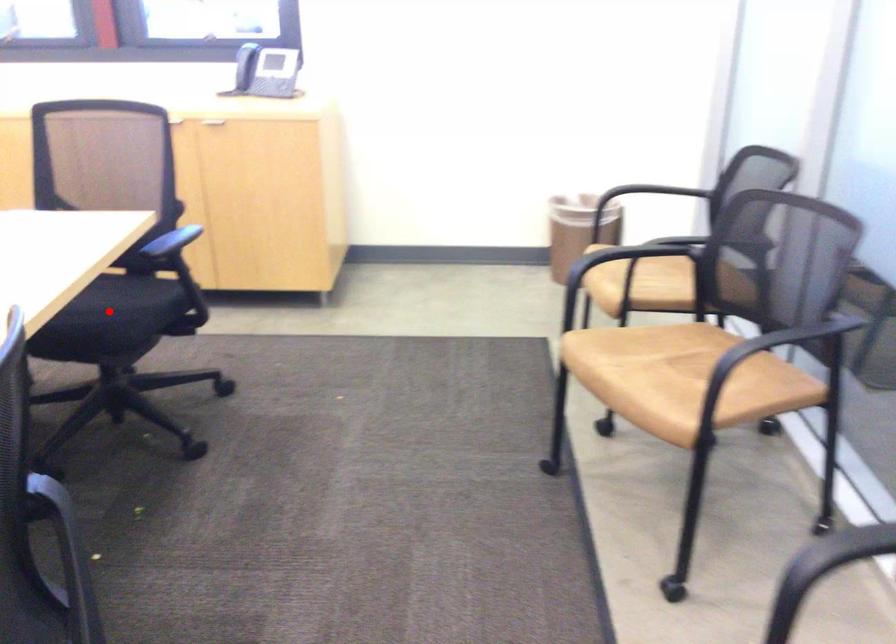
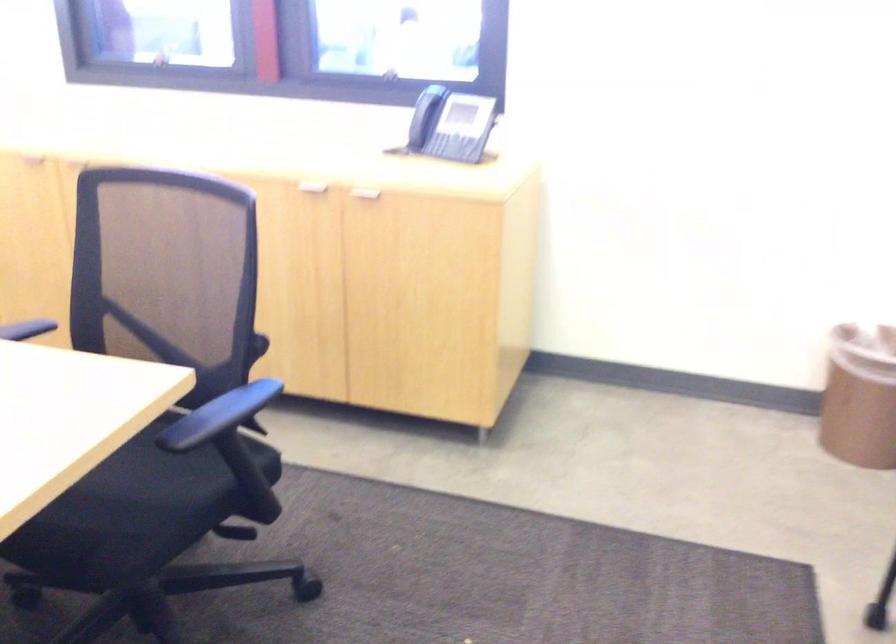
Locate, in the second image, the point that corresponds to the highlighted location in the first image.

(124, 498)